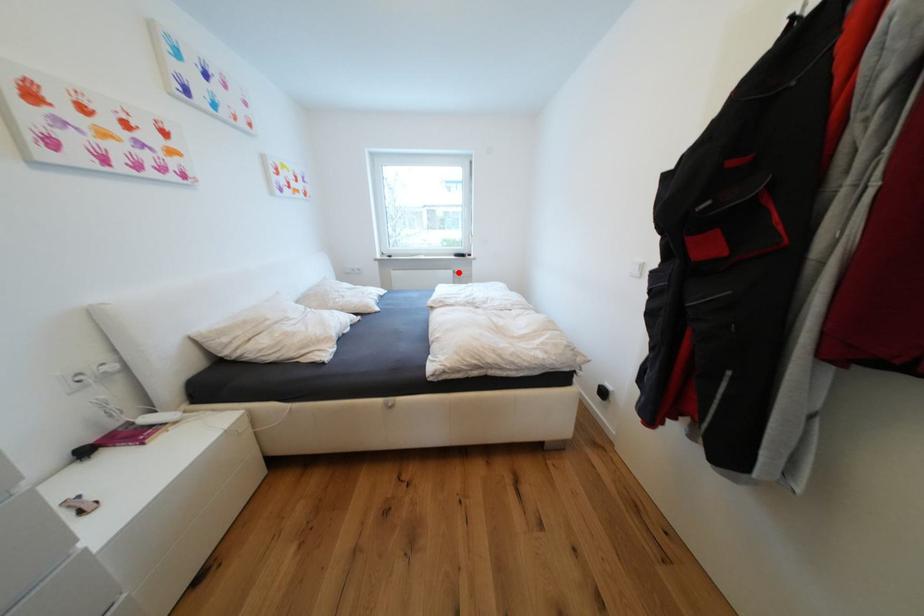
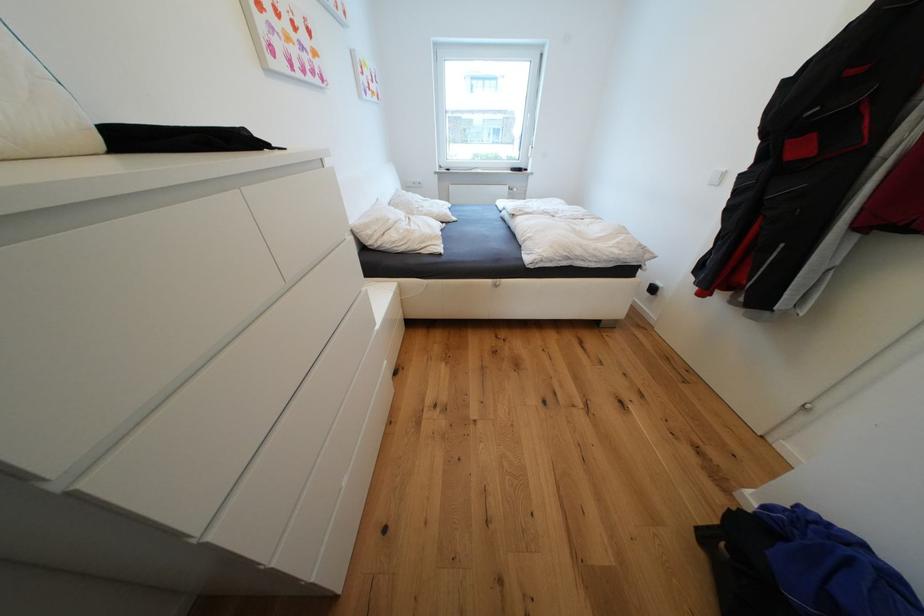
Find the pixel in the second image that matches the highlighted location in the first image.

(515, 188)